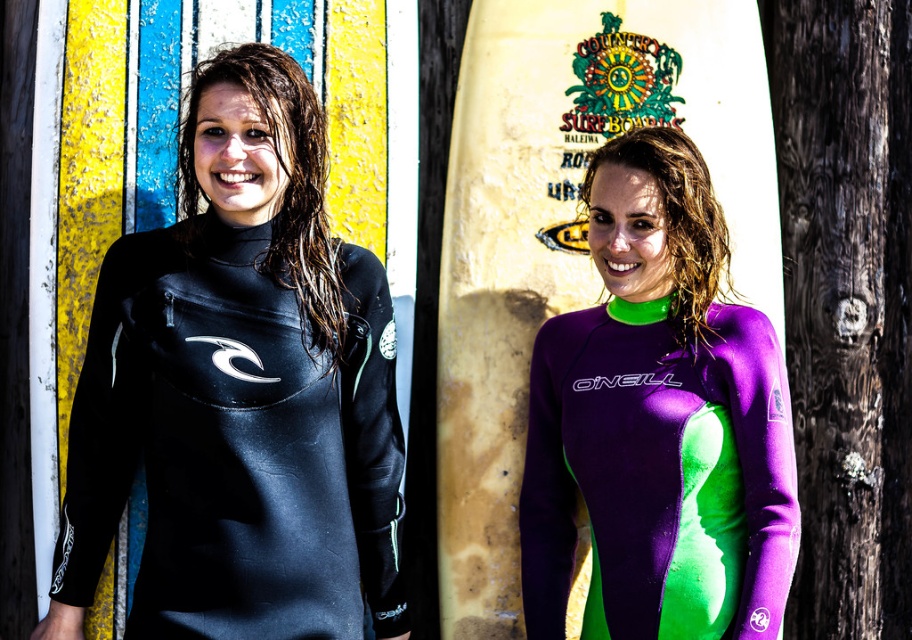
You are a lifeguard on duty and need to locate the black neoprene wetsuit at left. According to the coordinates provided, where exactly is it positioned in the image?

The black neoprene wetsuit at left is located at coordinates point (240, 392).